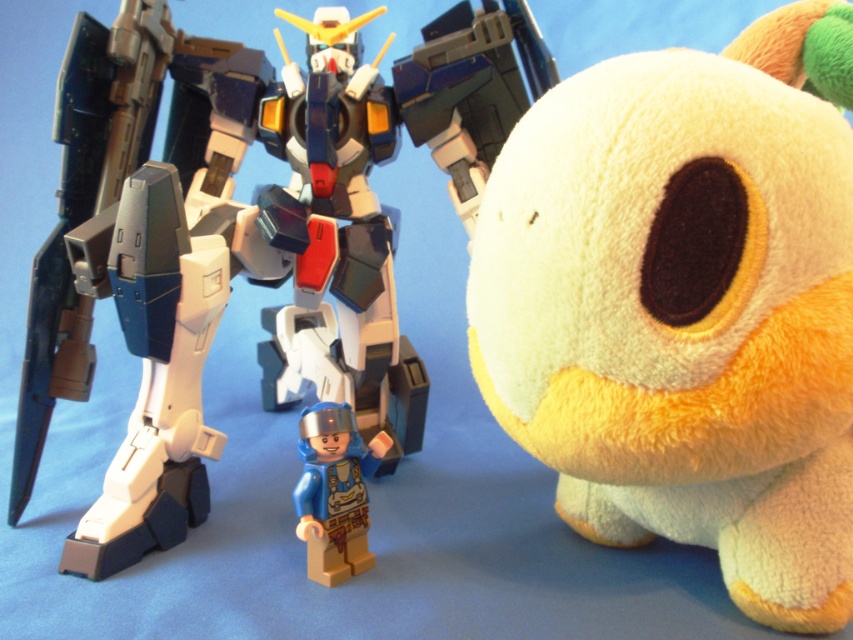
Question: Does yellow plush toy at center appear over plastic/smooth robot at center?

Choices:
 (A) no
 (B) yes

Answer: (A)

Question: From the image, what is the correct spatial relationship of shiny plastic robot at center in relation to blue plastic minifigure at center?

Choices:
 (A) below
 (B) above

Answer: (B)

Question: Which point is closer to the camera taking this photo?

Choices:
 (A) (368, 474)
 (B) (821, 10)
 (C) (287, 310)

Answer: (B)

Question: Does yellow plush toy at center have a lesser width compared to blue plastic minifigure at center?

Choices:
 (A) yes
 (B) no

Answer: (B)

Question: Based on their relative distances, which object is nearer to the shiny plastic robot at center?

Choices:
 (A) yellow plush toy at center
 (B) blue plastic minifigure at center

Answer: (B)

Question: Which point appears farthest from the camera in this image?

Choices:
 (A) (506, 124)
 (B) (381, 282)
 (C) (764, 577)

Answer: (B)